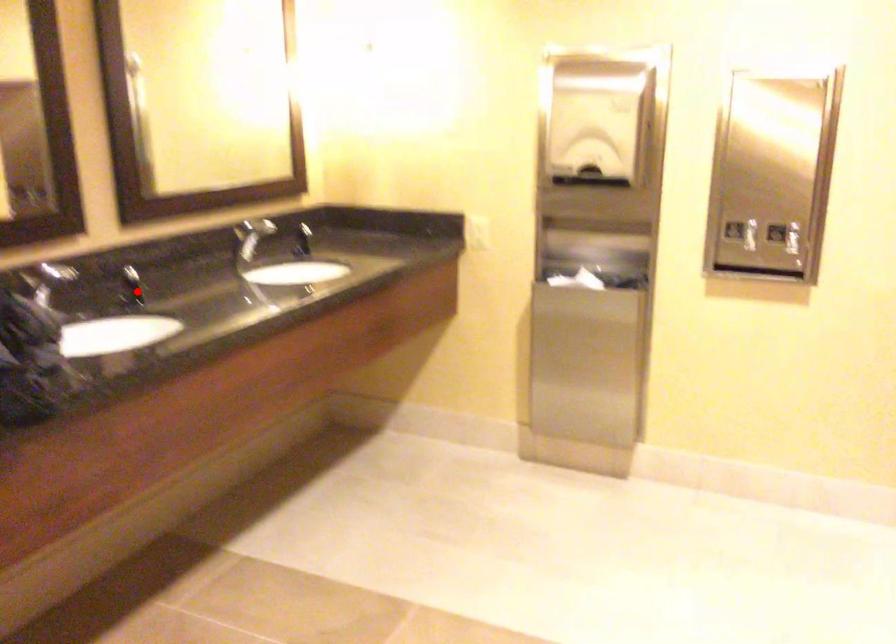
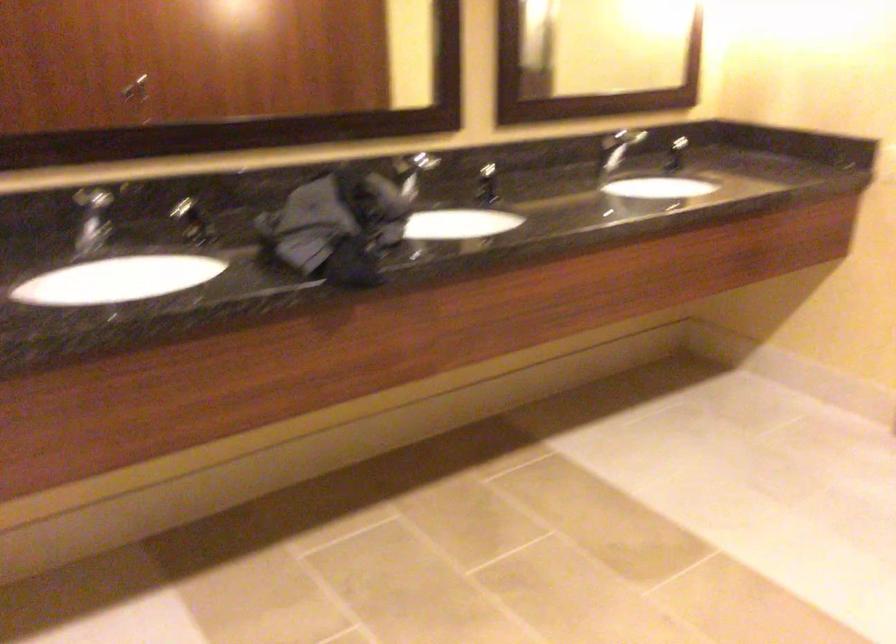
The point at the highlighted location is marked in the first image. Where is the corresponding point in the second image?

(487, 184)